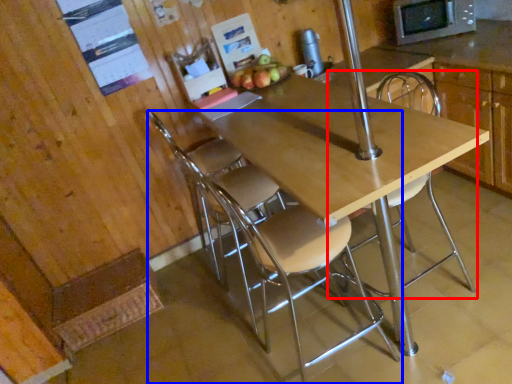
Question: Among these objects, which one is nearest to the camera, chair (highlighted by a red box) or chair (highlighted by a blue box)?

Choices:
 (A) chair
 (B) chair

Answer: (B)